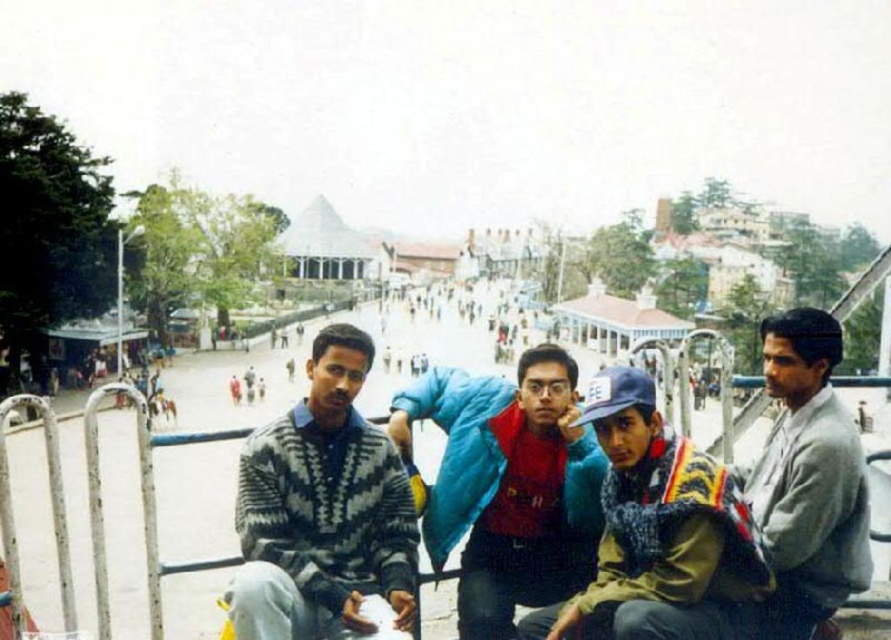
You are a photographer trying to capture a group photo of the two people wearing gray and white knitted sweater at center and gray wool sweater at right. If you want to frame them so that both sweaters are fully visible, which side should you position the wider sweater on to avoid cropping?

The gray and white knitted sweater at center is wider than the gray wool sweater at right. To avoid cropping, position the gray and white knitted sweater at center on the side with more space in the frame.

You are a photographer trying to capture a photo of the gray and white knitted sweater at center and the gray wool sweater at right. Which sweater should you focus on first if you want to include both in the same frame without moving the camera?

You should focus on the gray and white knitted sweater at center first because it is much taller than the gray wool sweater at right, so it will occupy more space in the frame.

You are a photographer trying to capture a photo of the gray and white knitted sweater at center and the blue fuzzy jacket at center. Which one is closer to the camera?

The gray and white knitted sweater at center is positioned under the blue fuzzy jacket at center, so the blue fuzzy jacket at center is closer to the camera.